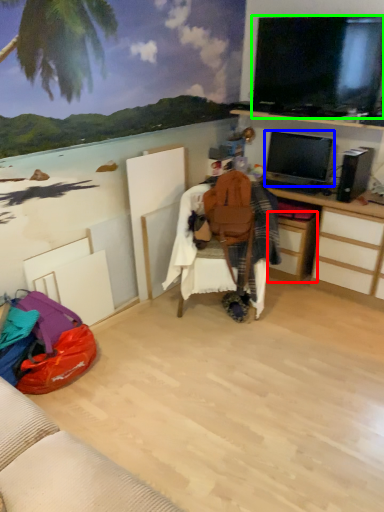
Question: Considering the real-world distances, which object is closest to drawer (highlighted by a red box)? television (highlighted by a blue box) or television (highlighted by a green box).

Choices:
 (A) television
 (B) television

Answer: (A)